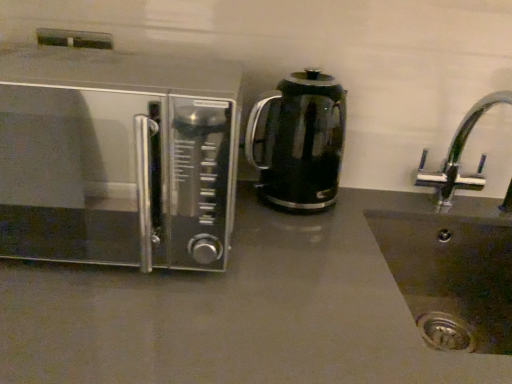
This screenshot has width=512, height=384. Find the location of `empty space that is in between satin silver microwave at left and black glass kettle at center`. empty space that is in between satin silver microwave at left and black glass kettle at center is located at coordinates (282, 243).